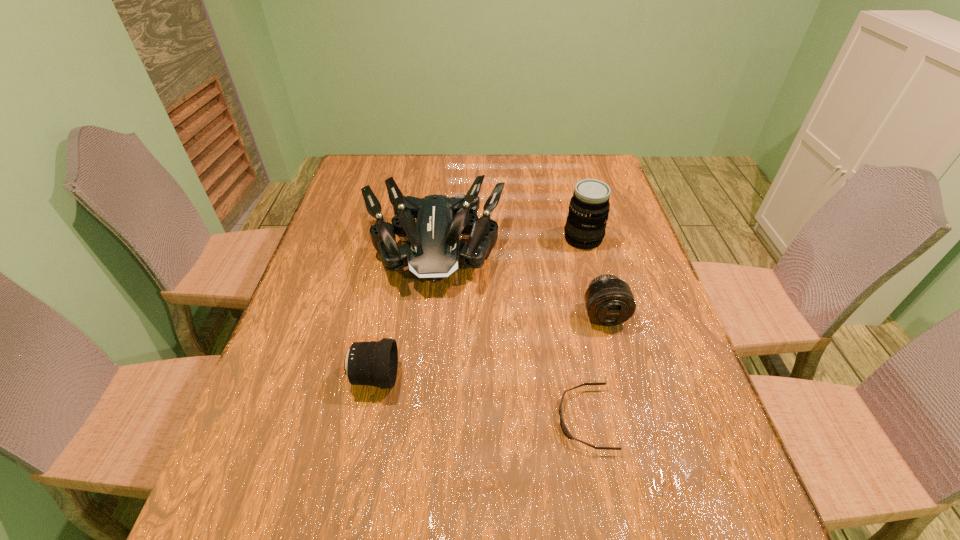
You are a GUI agent. You are given a task and a screenshot of the screen. Output one action in this format:
    pyautogui.click(x=<x>, y=<y>)
    Task: Click on the blank region between the leftmost telephoto lens and the drone
    
    Given the screenshot: What is the action you would take?
    pyautogui.click(x=404, y=313)

Identify the location of vacant area that lies between the second tallest object and the tallest telephoto lens. This screenshot has height=540, width=960. (508, 244).

The image size is (960, 540). Identify the location of vacant region between the second nearest telephoto lens and the tallest telephoto lens. (593, 277).

In order to click on vacant region between the tallest object and the third nearest object in this screenshot , I will do `click(593, 277)`.

This screenshot has width=960, height=540. What are the coordinates of `unoccupied position between the farthest telephoto lens and the nearest telephoto lens` in the screenshot? It's located at (479, 308).

Locate an element on the screen. This screenshot has height=540, width=960. unoccupied area between the fourth shortest object and the nearest telephoto lens is located at coordinates (404, 313).

Locate an element on the screen. The image size is (960, 540). unoccupied area between the second tallest object and the tallest object is located at coordinates (508, 244).

Where is `empty space that is in between the fourth shortest object and the tallest telephoto lens`? Image resolution: width=960 pixels, height=540 pixels. empty space that is in between the fourth shortest object and the tallest telephoto lens is located at coordinates (508, 244).

Find the location of a particular element. object that can be found as the closest to the leftmost telephoto lens is located at coordinates (434, 251).

This screenshot has height=540, width=960. In order to click on the third closest object to the nearest telephoto lens in this screenshot , I will do `click(609, 301)`.